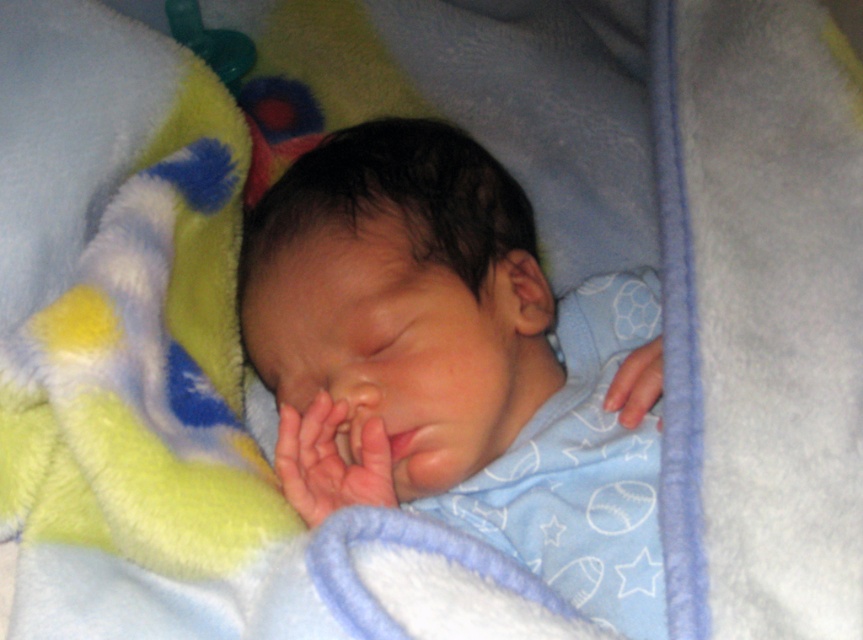
Question: Can you confirm if smooth skin hand at center is positioned to the left of smooth skin hand at lower right?

Choices:
 (A) yes
 (B) no

Answer: (A)

Question: Which point is farther to the camera?

Choices:
 (A) (616, 384)
 (B) (334, 483)

Answer: (A)

Question: Is smooth blue blanket at center thinner than smooth skin hand at lower right?

Choices:
 (A) yes
 (B) no

Answer: (B)

Question: Which point is farther to the camera?

Choices:
 (A) (268, 234)
 (B) (372, 474)
 (C) (653, 392)

Answer: (A)

Question: Can you confirm if smooth skin hand at center is wider than smooth skin hand at lower right?

Choices:
 (A) yes
 (B) no

Answer: (A)

Question: Which is nearer to the smooth blue blanket at center?

Choices:
 (A) smooth skin hand at lower right
 (B) smooth skin hand at center

Answer: (B)